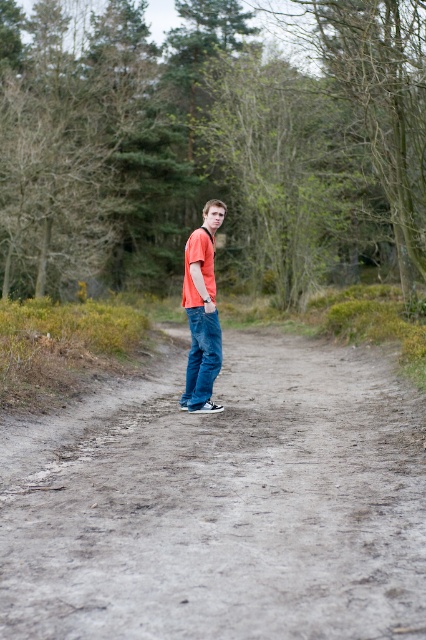
Question: Estimate the real-world distances between objects in this image. Which object is farther from the dull gray dirt track at center?

Choices:
 (A) green leafy trees at center
 (B) matte orange t-shirt at center

Answer: (A)

Question: Based on their relative distances, which object is nearer to the dull gray dirt track at center?

Choices:
 (A) green leafy trees at center
 (B) matte orange t-shirt at center

Answer: (B)

Question: Considering the real-world distances, which object is farthest from the green leafy trees at center?

Choices:
 (A) dull gray dirt track at center
 (B) matte orange t-shirt at center

Answer: (B)

Question: Can you confirm if green leafy trees at center is positioned to the left of matte orange t-shirt at center?

Choices:
 (A) no
 (B) yes

Answer: (A)

Question: Does dull gray dirt track at center appear on the left side of matte orange t-shirt at center?

Choices:
 (A) yes
 (B) no

Answer: (B)

Question: Is green leafy trees at center below matte orange t-shirt at center?

Choices:
 (A) yes
 (B) no

Answer: (B)